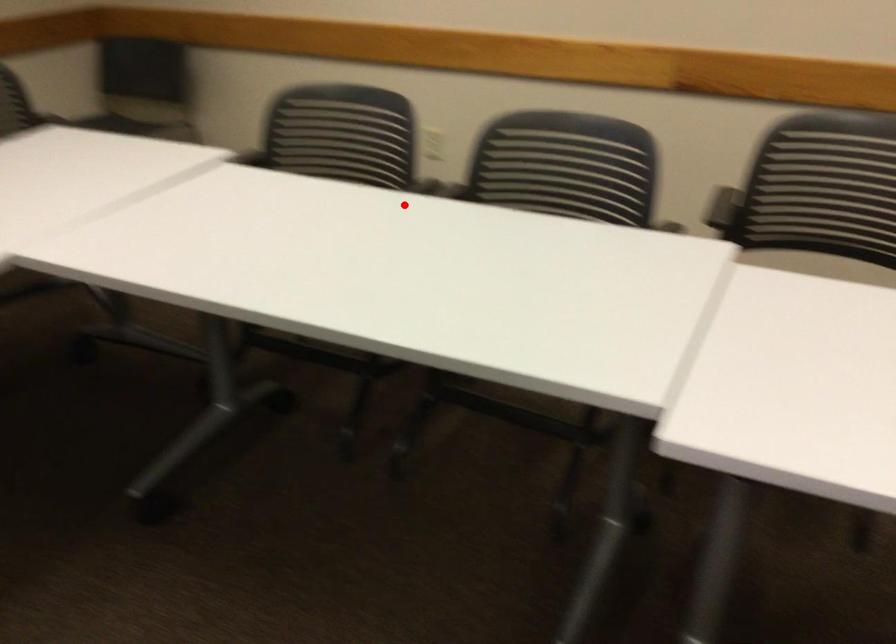
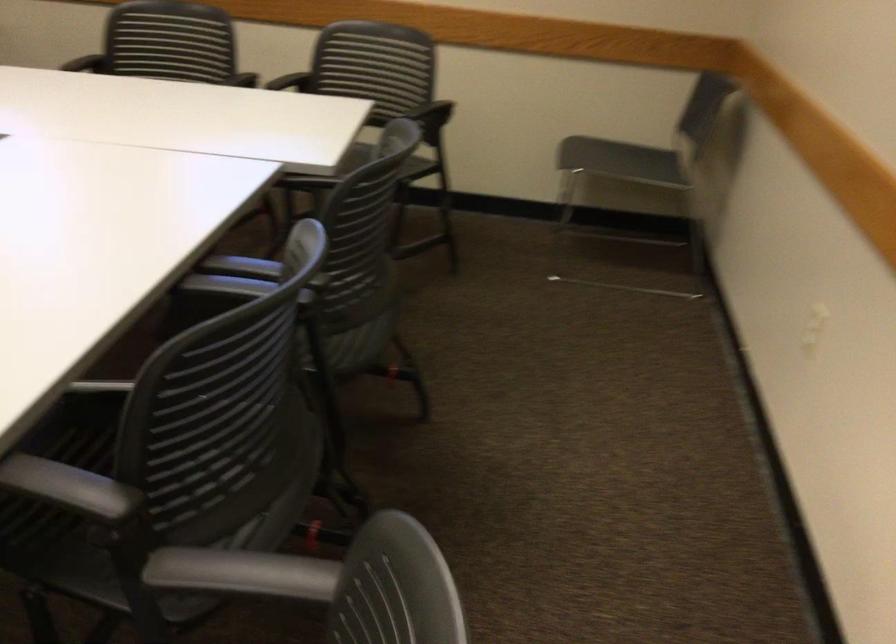
Question: I am providing you with two images of the same scene from different viewpoints. A red point is shown in image1. For the corresponding object point in image2, is it positioned nearer or farther from the camera?

Choices:
 (A) Nearer
 (B) Farther

Answer: (A)